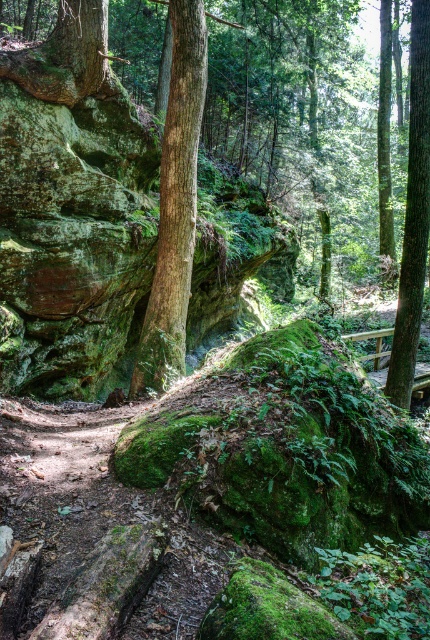
You are standing on the dirt path in the forest and see the green rough bark tree at center and the green rough bark tree at right. Which tree is closer to you?

The green rough bark tree at center is closer to you because it is in front of the green rough bark tree at right.

You are standing at the bottom left corner of the forest scene. You see a dirt path leading towards the center. There is a point marked at coordinates (x=108, y=227). What object is located at that point?

The point at coordinates (x=108, y=227) marks the green mossy rock at center.

You are standing at the bottom left corner of the forest scene and want to reach the green mossy rock at center. Which direction should you walk to get there?

Since the green mossy rock at center is located at point (108, 227) in the 2D space, you should walk towards the center of the image from the bottom left corner to reach it.